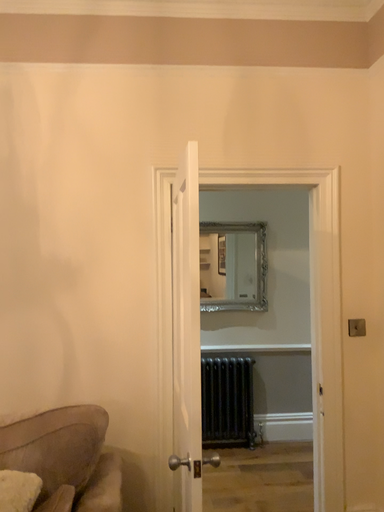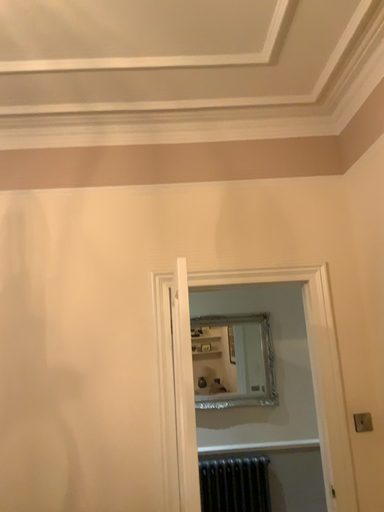
Question: How did the camera likely rotate when shooting the video?

Choices:
 (A) rotated upward
 (B) rotated downward

Answer: (A)